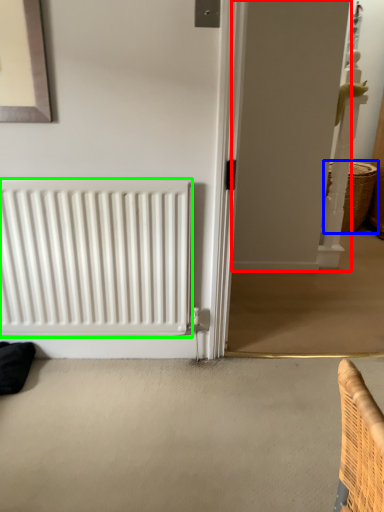
Question: Based on their relative distances, which object is farther from screen door (highlighted by a red box)? Choose from basket (highlighted by a blue box) and radiator (highlighted by a green box).

Choices:
 (A) basket
 (B) radiator

Answer: (B)